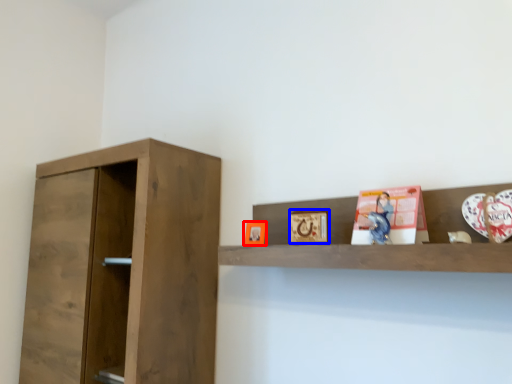
Question: Which object appears farthest to the camera in this image, picture frame (highlighted by a red box) or picture frame (highlighted by a blue box)?

Choices:
 (A) picture frame
 (B) picture frame

Answer: (A)